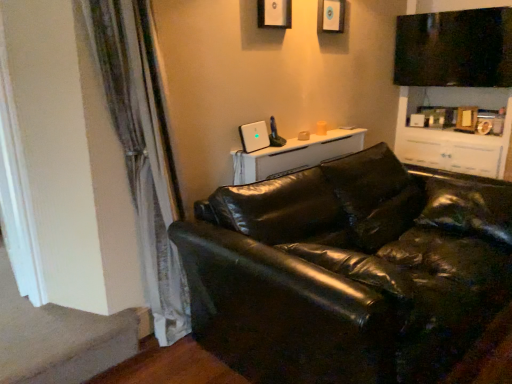
Question: In the image, is white glossy table at upper center on the left side or the right side of carpet at lower left?

Choices:
 (A) left
 (B) right

Answer: (B)

Question: From a real-world perspective, is white glossy table at upper center positioned above or below carpet at lower left?

Choices:
 (A) above
 (B) below

Answer: (A)

Question: Based on their relative distances, which object is farther from the black leather couch at lower right?

Choices:
 (A) silky white curtain at left
 (B) white glossy table at upper center
 (C) carpet at lower left
 (D) matte black picture frame at upper center, which is counted as the 1th picture frame, starting from the front
 (E) matte white picture frame at upper center, the 1th picture frame positioned from the back

Answer: (E)

Question: Estimate the real-world distances between objects in this image. Which object is farther from the black leather couch at lower right?

Choices:
 (A) carpet at lower left
 (B) matte white picture frame at upper center, arranged as the second picture frame when viewed from the front
 (C) white glossy table at upper center
 (D) matte black picture frame at upper center, which is the second picture frame in right-to-left order
 (E) silky white curtain at left

Answer: (B)